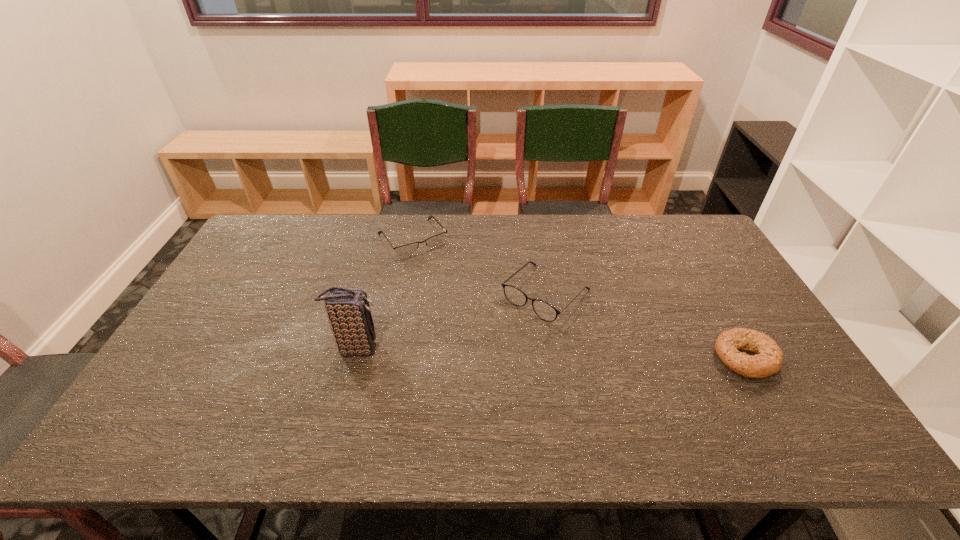
At what (x,y) coordinates should I click in order to perform the action: click on vacant space at the left edge of the desktop. Please return your answer as a coordinate pair (x, y). Looking at the image, I should click on (243, 262).

Locate an element on the screen. This screenshot has width=960, height=540. free region at the right edge of the desktop is located at coordinates (691, 266).

Where is `vacant space at the near left corner of the desktop`? The image size is (960, 540). vacant space at the near left corner of the desktop is located at coordinates (169, 400).

Identify the location of vacant region at the far right corner. (661, 218).

You are a GUI agent. You are given a task and a screenshot of the screen. Output one action in this format:
    pyautogui.click(x=<x>, y=<y>)
    Task: Click on the empty location between the third nearest object and the clutch bag
    This screenshot has width=960, height=540.
    Given the screenshot: What is the action you would take?
    pyautogui.click(x=451, y=321)

Image resolution: width=960 pixels, height=540 pixels. I want to click on free space between the bagel and the third object from left to right, so click(x=645, y=326).

What are the coordinates of `vacant region between the left spectacles and the clutch bag` in the screenshot? It's located at (384, 293).

This screenshot has height=540, width=960. Identify the location of vacant region between the right spectacles and the clutch bag. (451, 321).

Find the location of `free space between the tallest object and the right spectacles`. free space between the tallest object and the right spectacles is located at coordinates pyautogui.click(x=451, y=321).

Find the location of a particular element. The height and width of the screenshot is (540, 960). vacant space that is in between the tallest object and the rightmost object is located at coordinates (551, 353).